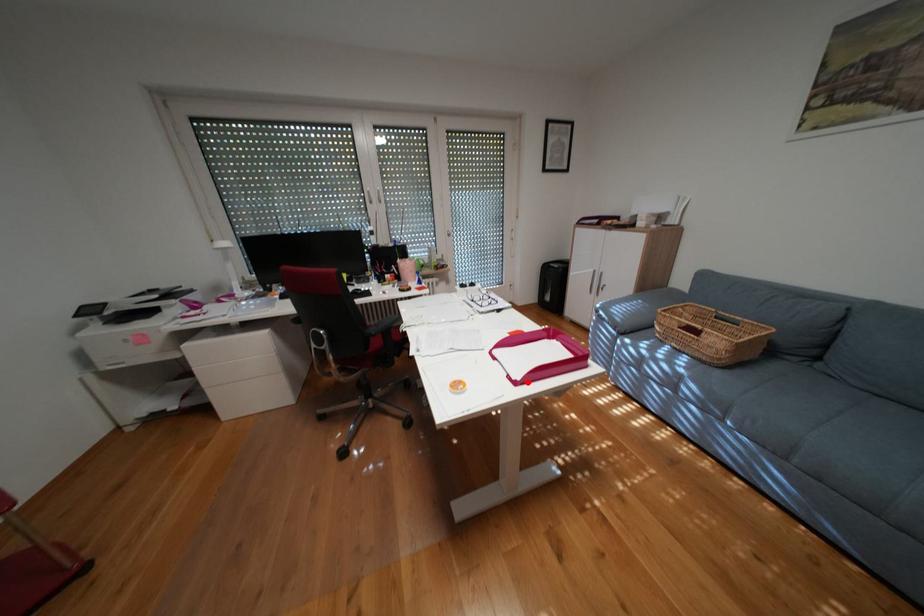
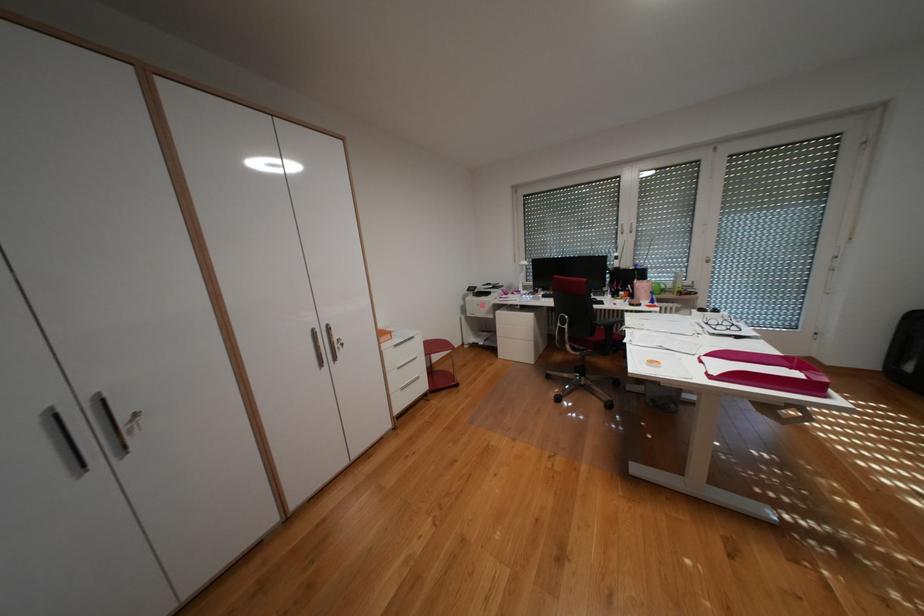
Locate, in the second image, the point that corresponds to the highlighted location in the first image.

(723, 377)